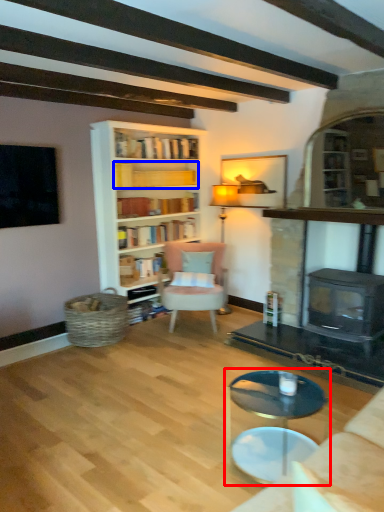
Question: Which object appears farthest to the camera in this image, coffee table (highlighted by a red box) or book (highlighted by a blue box)?

Choices:
 (A) coffee table
 (B) book

Answer: (B)